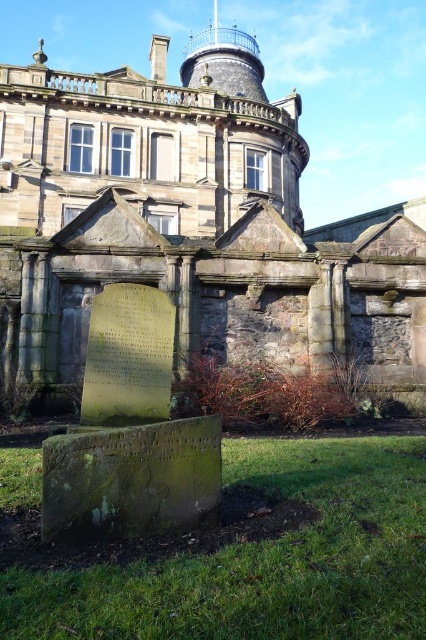
Question: Can you confirm if green mossy stone monument at lower left is smaller than green mossy stone gravestone at lower center?

Choices:
 (A) yes
 (B) no

Answer: (A)

Question: Is green mossy stone monument at lower left closer to camera compared to green mossy stone gravestone at lower center?

Choices:
 (A) no
 (B) yes

Answer: (A)

Question: Among these objects, which one is farthest from the camera?

Choices:
 (A) green mossy stone gravestone at lower center
 (B) green mossy stone monument at lower left

Answer: (B)

Question: Is green mossy stone monument at lower left smaller than green mossy stone gravestone at lower center?

Choices:
 (A) yes
 (B) no

Answer: (A)

Question: Which point appears closest to the camera in this image?

Choices:
 (A) (132, 328)
 (B) (189, 500)

Answer: (B)